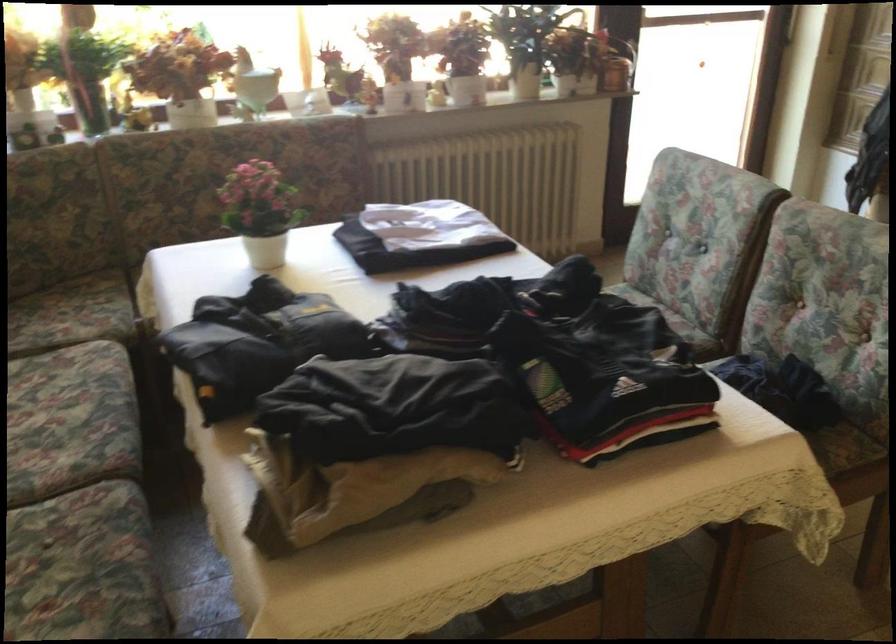
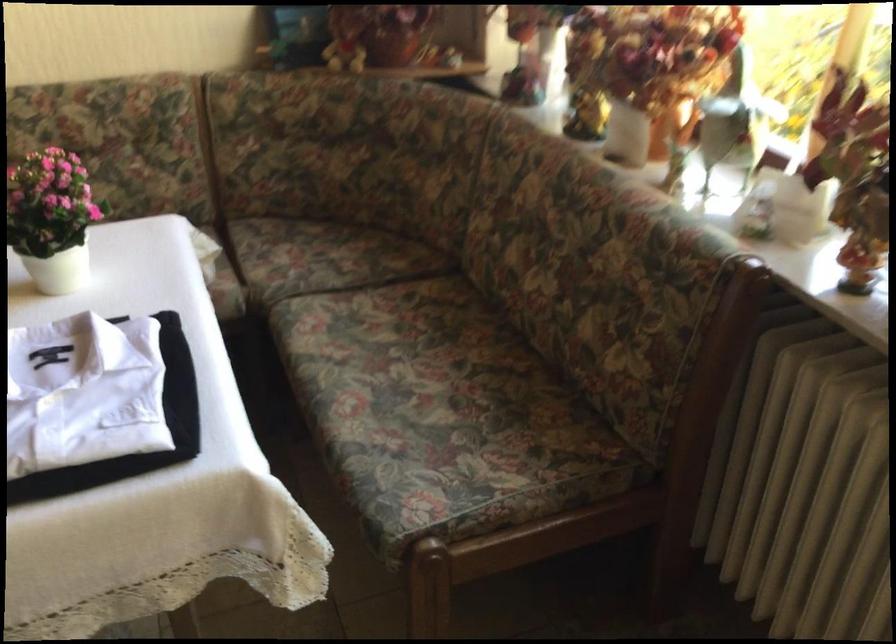
In the second image, find the point that corresponds to (73,313) in the first image.

(306, 252)